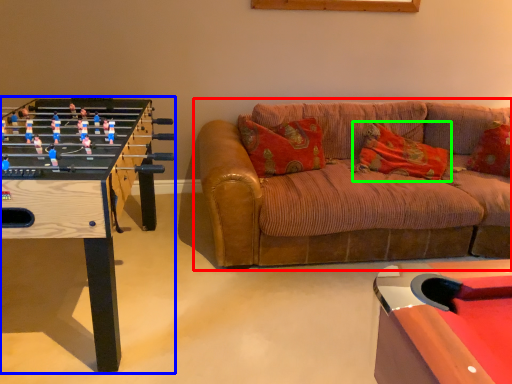
Question: Which object is the farthest from studio couch (highlighted by a red box)? Choose among these: table (highlighted by a blue box) or pillow (highlighted by a green box).

Choices:
 (A) table
 (B) pillow

Answer: (A)